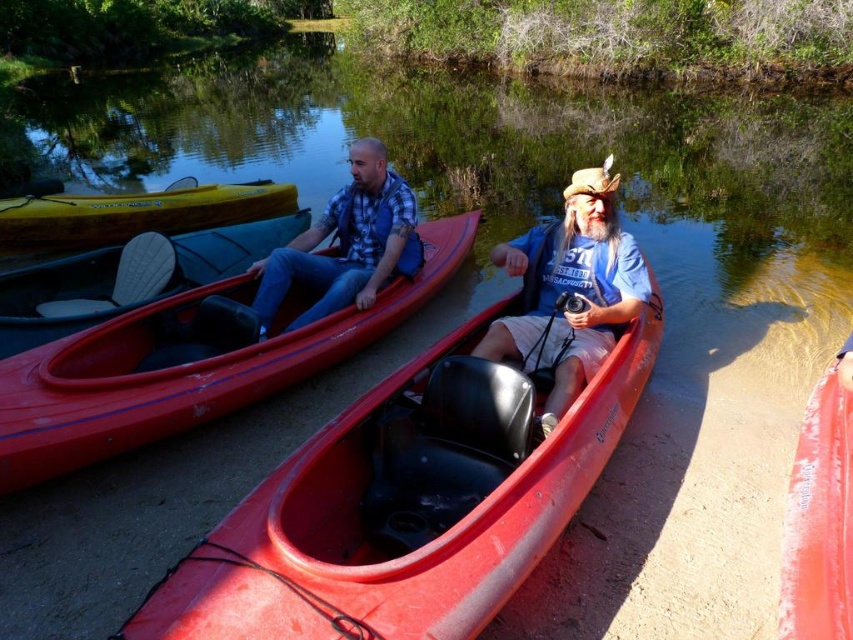
From the picture: You are a photographer trying to capture the blue cotton shirt at center and the matte blue vest at center in a single shot. Which object should you focus on first to ensure both are in focus?

The blue cotton shirt at center is closer to the viewer than the matte blue vest at center. To ensure both are in focus, you should focus on the matte blue vest at center because focusing on the farther object allows the depth of field to cover the closer one as well.

You are planning to place a 5 feet long wooden board between the blue cotton shirt at center and the matte blue vest at center. Will the board fit between them?

The blue cotton shirt at center and matte blue vest at center are 4.69 feet apart. The 5 feet long wooden board is longer than the distance between them, so it will not fit between them.

You are a photographer trying to capture a clear shot of the blue cotton shirt at center and the rubberized red canoe at lower right. Since the canoe is behind the shirt, will the canoe be visible in the photo if you focus on the shirt?

The rubberized red canoe at lower right is behind the blue cotton shirt at center, so if you focus on the blue cotton shirt at center, the canoe may be partially or fully obscured depending on their positions. However, since they are positioned side by side on the riverbank, there might still be a chance to see the canoe if the shirt wearer isn